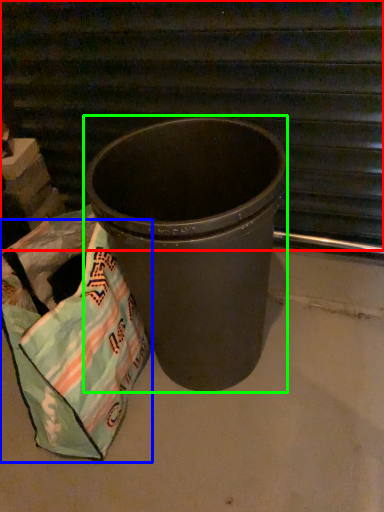
Question: Which object is positioned closest to stairwell (highlighted by a red box)? Select from grocery bag (highlighted by a blue box) and waste container (highlighted by a green box).

Choices:
 (A) grocery bag
 (B) waste container

Answer: (B)